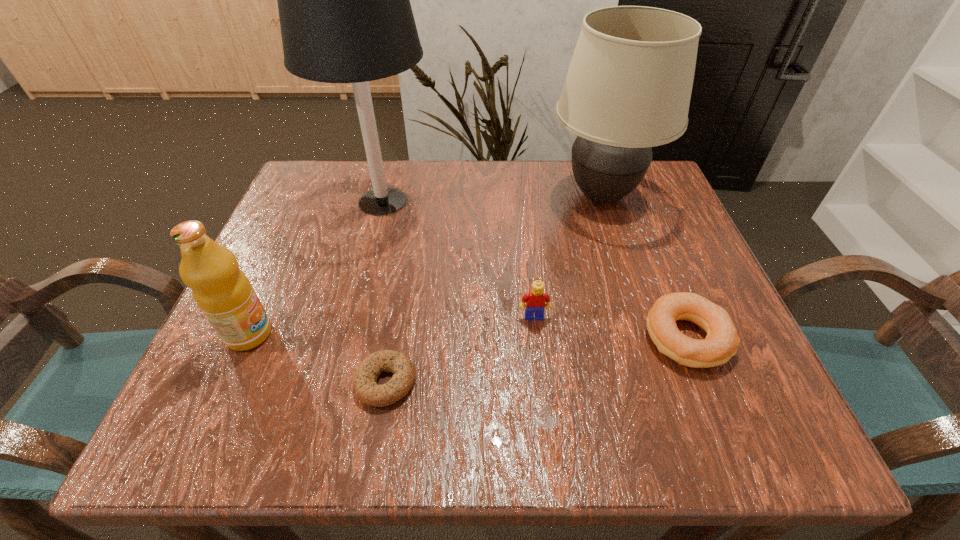
You are a GUI agent. You are given a task and a screenshot of the screen. Output one action in this format:
    pyautogui.click(x=<x>, y=<y>)
    Task: Click on the vacant space at the near left corner of the desktop
    This screenshot has width=960, height=540.
    Given the screenshot: What is the action you would take?
    tap(172, 436)

Locate an element on the screen. free space at the far right corner of the desktop is located at coordinates (654, 218).

Locate an element on the screen. Image resolution: width=960 pixels, height=540 pixels. empty space that is in between the taller bagel and the third shortest object is located at coordinates (611, 327).

I want to click on vacant space that is in between the fourth shortest object and the second tallest object, so click(425, 265).

This screenshot has height=540, width=960. In order to click on empty space between the table lamp and the fifth shortest object in this screenshot , I will do `click(492, 199)`.

The image size is (960, 540). In order to click on vacant space that's between the third tallest object and the Lego in this screenshot , I will do `click(392, 325)`.

Image resolution: width=960 pixels, height=540 pixels. Find the location of `vacant area between the third tallest object and the table lamp`. vacant area between the third tallest object and the table lamp is located at coordinates (316, 267).

At what (x,y) coordinates should I click in order to perform the action: click on vacant area between the shortest object and the fifth shortest object. Please return your answer as a coordinate pair (x, y). This screenshot has height=540, width=960. Looking at the image, I should click on (493, 289).

Where is `empty space that is in between the fourth shortest object and the third shortest object`? This screenshot has height=540, width=960. empty space that is in between the fourth shortest object and the third shortest object is located at coordinates (392, 325).

At what (x,y) coordinates should I click in order to perform the action: click on free space between the fruit juice and the taller bagel. Please return your answer as a coordinate pair (x, y). Looking at the image, I should click on pyautogui.click(x=468, y=336).